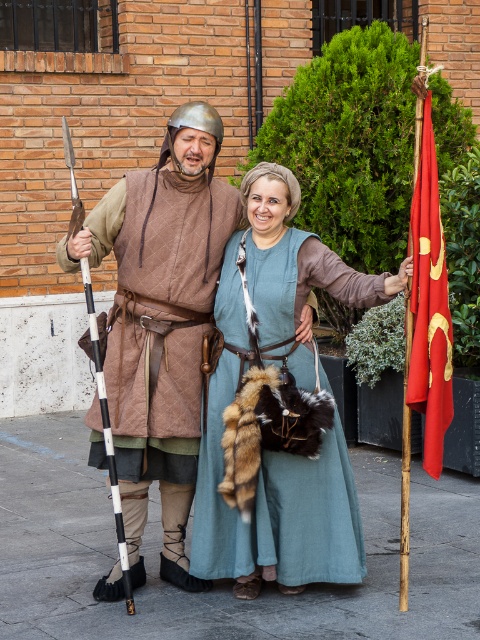
Question: Estimate the real-world distances between objects in this image. Which object is closer to the white and black speckled staff at left?

Choices:
 (A) teal linen dress at center
 (B) quilted brown vest at left

Answer: (B)

Question: Can you confirm if quilted brown vest at left is positioned below white and black speckled staff at left?

Choices:
 (A) yes
 (B) no

Answer: (B)

Question: Does teal linen dress at center have a greater width compared to white and black speckled staff at left?

Choices:
 (A) yes
 (B) no

Answer: (A)

Question: Which of the following is the closest to the observer?

Choices:
 (A) white and black speckled staff at left
 (B) quilted brown vest at left
 (C) teal linen dress at center

Answer: (A)

Question: Which point is farther from the camera taking this photo?

Choices:
 (A) click(103, 330)
 (B) click(319, 280)
 (C) click(188, 262)

Answer: (A)

Question: Does quilted brown vest at left have a greater width compared to teal linen dress at center?

Choices:
 (A) no
 (B) yes

Answer: (A)